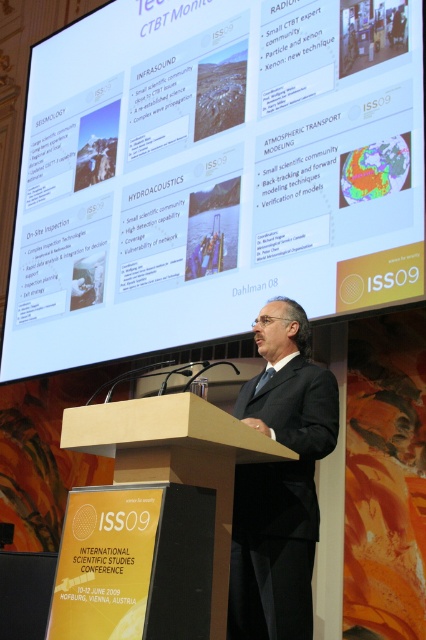
Which is in front, point (178, 288) or point (284, 605)?

Point (284, 605) is more forward.

Does point (176, 140) lie in front of point (278, 483)?

No.

Is point (328, 70) more distant than point (261, 481)?

Yes.

Where is `white glossy projection screen at upper center`? This screenshot has width=426, height=640. white glossy projection screen at upper center is located at coordinates (213, 173).

Can you confirm if white glossy projection screen at upper center is shorter than brown wood podium at center?

No.

Consider the image. Which is more to the left, white glossy projection screen at upper center or brown wood podium at center?

From the viewer's perspective, white glossy projection screen at upper center appears more on the left side.

Who is more forward, (172,60) or (123,422)?

Point (123,422) is more forward.

In order to click on white glossy projection screen at upper center in this screenshot , I will do `click(213, 173)`.

Image resolution: width=426 pixels, height=640 pixels. Find the location of `black suit at center`. black suit at center is located at coordinates (279, 481).

Does black suit at center have a lesser width compared to brown wood podium at center?

Yes, black suit at center is thinner than brown wood podium at center.

Between point (316, 456) and point (210, 608), which one is positioned in front?

Point (210, 608)

At what (x,y) coordinates should I click in order to perform the action: click on black suit at center. Please return your answer as a coordinate pair (x, y). This screenshot has width=426, height=640. Looking at the image, I should click on (279, 481).